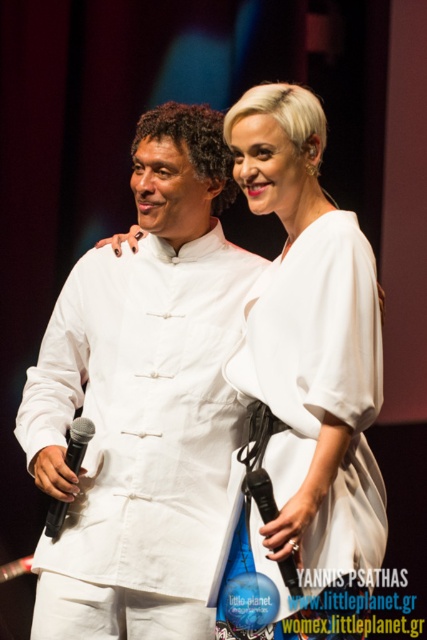
Who is shorter, white satin dress at center or black matte microphone at left?

black matte microphone at left

Who is more forward, (306, 314) or (70, 467)?

Positioned in front is point (306, 314).

Which is in front, point (374, 412) or point (47, 532)?

Point (374, 412)

Identify the location of white satin dress at center. The height and width of the screenshot is (640, 427). (309, 416).

Does white matte shirt at center lie behind black plastic microphone at center?

Yes, it is behind black plastic microphone at center.

The width and height of the screenshot is (427, 640). Describe the element at coordinates (143, 401) in the screenshot. I see `white matte shirt at center` at that location.

Between point (177, 417) and point (266, 492), which one is positioned behind?

The point (177, 417) is behind.

Identify the location of white matte shirt at center. Image resolution: width=427 pixels, height=640 pixels. (143, 401).

Does white satin dress at center appear under black plastic microphone at center?

No, white satin dress at center is not below black plastic microphone at center.

Is white satin dress at center closer to the viewer compared to black plastic microphone at center?

No, white satin dress at center is behind black plastic microphone at center.

Measure the distance between white satin dress at center and camera.

white satin dress at center is 5.73 feet from camera.

The height and width of the screenshot is (640, 427). Find the location of `white satin dress at center`. white satin dress at center is located at coordinates (309, 416).